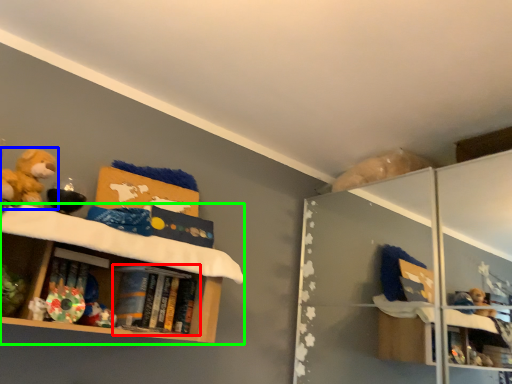
Question: Which is nearer to the book (highlighted by a red box)? toy (highlighted by a blue box) or shelf (highlighted by a green box).

Choices:
 (A) toy
 (B) shelf

Answer: (B)